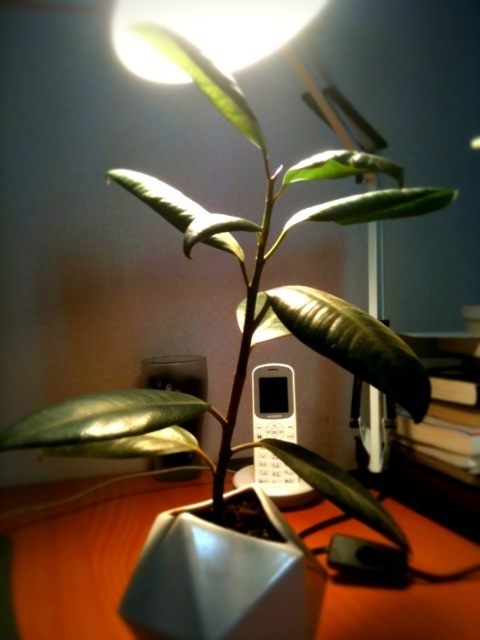
Between wooden table at center and white plastic phone at center, which one is positioned lower?

wooden table at center

Who is more forward, (72, 602) or (254, 369)?

Point (72, 602)

Does point (101, 529) come farther from viewer compared to point (290, 429)?

No, it is in front of (290, 429).

Where is `wooden table at center`? wooden table at center is located at coordinates (83, 548).